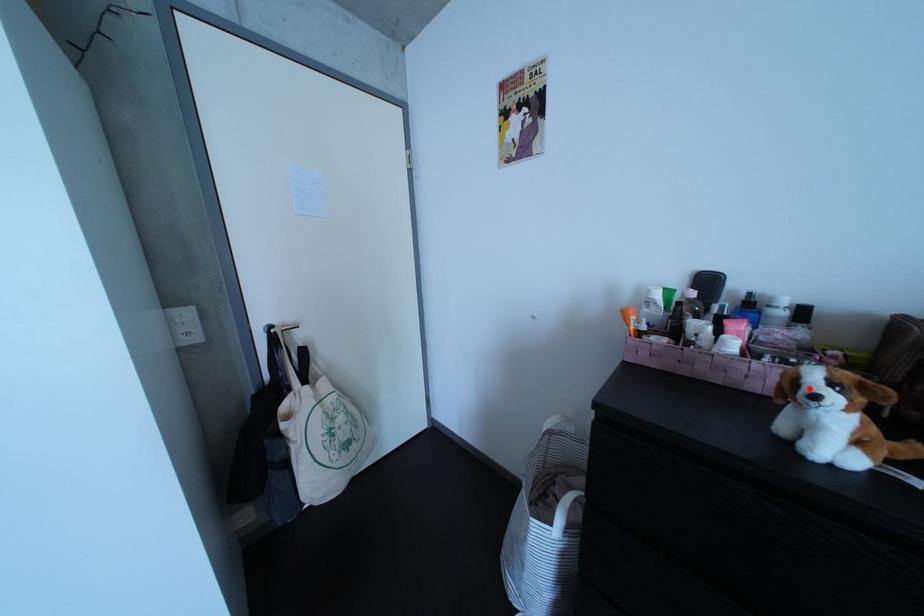
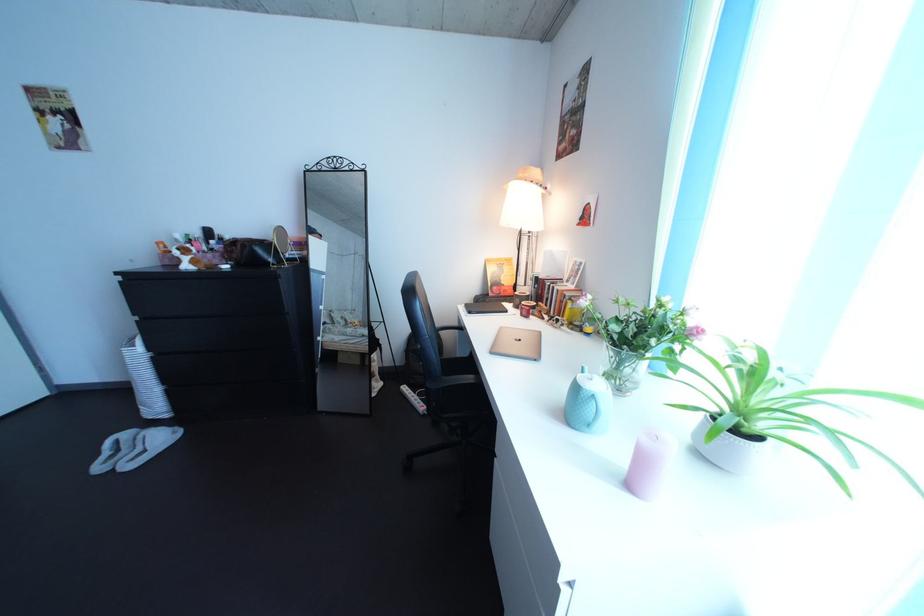
Question: I am providing you with two images of the same scene from different viewpoints. A red point is marked on the first image. Can you still see the location of the red point in image 2?

Choices:
 (A) Yes
 (B) No

Answer: (B)